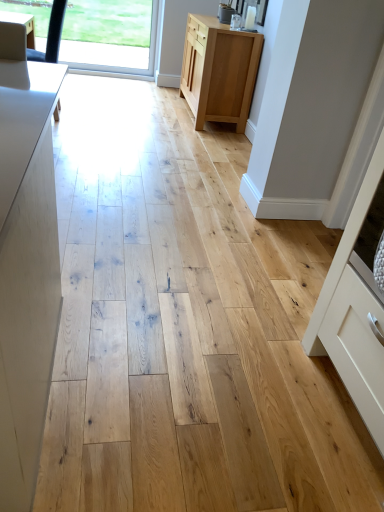
How much space does natural wood cabinet at center, which is the first cabinetry from top to bottom, occupy horizontally?

It is 49.96 centimeters.

This screenshot has width=384, height=512. What do you see at coordinates (114, 54) in the screenshot?
I see `transparent glass window at upper left` at bounding box center [114, 54].

You are a GUI agent. You are given a task and a screenshot of the screen. Output one action in this format:
    pyautogui.click(x=<x>, y=<y>)
    Task: Click on the transparent glass window at upper left
    
    Given the screenshot: What is the action you would take?
    pyautogui.click(x=114, y=54)

Identify the location of white matte cabinet at right, the 1th cabinetry positioned from the right. This screenshot has height=512, width=384. (357, 304).

The height and width of the screenshot is (512, 384). What are the coordinates of `natural wood cabinet at center, which is counted as the second cabinetry, starting from the front` in the screenshot? It's located at (219, 71).

From a real-world perspective, between white matte cabinet at right, the 1th cabinetry positioned from the right, and transparent glass window at upper left, who is vertically higher?

white matte cabinet at right, the 1th cabinetry positioned from the right, from a real-world perspective.

Between point (358, 287) and point (157, 13), which one is positioned behind?

Positioned behind is point (157, 13).

Considering the relative sizes of white matte cabinet at right, arranged as the second cabinetry when viewed from the left, and transparent glass window at upper left in the image provided, is white matte cabinet at right, arranged as the second cabinetry when viewed from the left, wider than transparent glass window at upper left?

Correct, the width of white matte cabinet at right, arranged as the second cabinetry when viewed from the left, exceeds that of transparent glass window at upper left.

Which object is further away from the camera taking this photo, white matte cabinet at right, the 2th cabinetry in the back-to-front sequence, or transparent glass window at upper left?

transparent glass window at upper left.

How different are the orientations of transparent glass window at upper left and white matte cabinet at right, the 2th cabinetry when ordered from top to bottom, in degrees?

89.5 degrees separate the facing orientations of transparent glass window at upper left and white matte cabinet at right, the 2th cabinetry when ordered from top to bottom.

Does transparent glass window at upper left come behind white matte cabinet at right, the first cabinetry positioned from the front?

Yes, the depth of transparent glass window at upper left is greater than that of white matte cabinet at right, the first cabinetry positioned from the front.

Where is `window screen below the white matte cabinet at right, the 2th cabinetry when ordered from top to bottom (from a real-world perspective)`? window screen below the white matte cabinet at right, the 2th cabinetry when ordered from top to bottom (from a real-world perspective) is located at coordinates (114, 54).

Can white matte cabinet at right, the 2th cabinetry in the back-to-front sequence, be found inside transparent glass window at upper left?

No, white matte cabinet at right, the 2th cabinetry in the back-to-front sequence, is not surrounded by transparent glass window at upper left.

The width and height of the screenshot is (384, 512). Identify the location of cabinetry on the right of natural wood cabinet at center, which appears as the second cabinetry when ordered from the bottom. (357, 304).

Which object is further away from the camera, natural wood cabinet at center, which is counted as the second cabinetry, starting from the front, or white matte cabinet at right, arranged as the second cabinetry when viewed from the left?

natural wood cabinet at center, which is counted as the second cabinetry, starting from the front.

Can you see natural wood cabinet at center, which is the first cabinetry from top to bottom, touching white matte cabinet at right, arranged as the second cabinetry when viewed from the left?

No, natural wood cabinet at center, which is the first cabinetry from top to bottom, is not in contact with white matte cabinet at right, arranged as the second cabinetry when viewed from the left.

Is white matte cabinet at right, arranged as the second cabinetry when viewed from the left, completely or partially outside of natural wood cabinet at center, positioned as the first cabinetry in left-to-right order?

Yes, white matte cabinet at right, arranged as the second cabinetry when viewed from the left, is located beyond the bounds of natural wood cabinet at center, positioned as the first cabinetry in left-to-right order.

Find the location of a particular element. The height and width of the screenshot is (512, 384). cabinetry to the left of white matte cabinet at right, the first cabinetry positioned from the front is located at coordinates (219, 71).

Considering the relative positions of white matte cabinet at right, the 2th cabinetry in the back-to-front sequence, and natural wood cabinet at center, positioned as the first cabinetry in left-to-right order, in the image provided, is white matte cabinet at right, the 2th cabinetry in the back-to-front sequence, to the left of natural wood cabinet at center, positioned as the first cabinetry in left-to-right order, from the viewer's perspective?

No.

Which is behind, transparent glass window at upper left or natural wood cabinet at center, which appears as the second cabinetry when ordered from the bottom?

transparent glass window at upper left is more distant.

Is transparent glass window at upper left positioned with its back to natural wood cabinet at center, which is the first cabinetry from top to bottom?

No, natural wood cabinet at center, which is the first cabinetry from top to bottom, is not at the back of transparent glass window at upper left.

Does transparent glass window at upper left have a lesser width compared to natural wood cabinet at center, positioned as the first cabinetry in left-to-right order?

Yes.

Measure the distance from transparent glass window at upper left to natural wood cabinet at center, which is counted as the second cabinetry, starting from the front.

A distance of 1.13 meters exists between transparent glass window at upper left and natural wood cabinet at center, which is counted as the second cabinetry, starting from the front.

Which object is more forward, natural wood cabinet at center, positioned as the first cabinetry in left-to-right order, or transparent glass window at upper left?

natural wood cabinet at center, positioned as the first cabinetry in left-to-right order.

Which is less distant, (219, 75) or (75, 52)?

Point (219, 75) is closer to the camera than point (75, 52).

Consider the image. Choose the correct answer: Is natural wood cabinet at center, which appears as the second cabinetry when ordered from the bottom, inside transparent glass window at upper left or outside it?

natural wood cabinet at center, which appears as the second cabinetry when ordered from the bottom, is located beyond the bounds of transparent glass window at upper left.

From the image's perspective, between natural wood cabinet at center, which appears as the second cabinetry when ordered from the bottom, and transparent glass window at upper left, who is located below?

natural wood cabinet at center, which appears as the second cabinetry when ordered from the bottom, is shown below in the image.

You are a GUI agent. You are given a task and a screenshot of the screen. Output one action in this format:
    pyautogui.click(x=<x>, y=<y>)
    Task: Click on the window screen that appears below the white matte cabinet at right, the 2th cabinetry when ordered from top to bottom (from a real-world perspective)
    This screenshot has width=384, height=512.
    Given the screenshot: What is the action you would take?
    pyautogui.click(x=114, y=54)

Locate an element on the screen. The width and height of the screenshot is (384, 512). cabinetry above the transparent glass window at upper left (from a real-world perspective) is located at coordinates (357, 304).

Estimate the real-world distances between objects in this image. Which object is closer to natural wood cabinet at center, which is the first cabinetry from top to bottom, transparent glass window at upper left or white matte cabinet at right, the 2th cabinetry in the back-to-front sequence?

The object closer to natural wood cabinet at center, which is the first cabinetry from top to bottom, is transparent glass window at upper left.

Which object lies nearer to the anchor point white matte cabinet at right, arranged as the second cabinetry when viewed from the left, natural wood cabinet at center, arranged as the 2th cabinetry when viewed from the right, or transparent glass window at upper left?

natural wood cabinet at center, arranged as the 2th cabinetry when viewed from the right, lies closer to white matte cabinet at right, arranged as the second cabinetry when viewed from the left, than the other object.

From the image, which object appears to be farther from natural wood cabinet at center, which is counted as the second cabinetry, starting from the front, white matte cabinet at right, which ranks as the first cabinetry in bottom-to-top order, or transparent glass window at upper left?

white matte cabinet at right, which ranks as the first cabinetry in bottom-to-top order, is further to natural wood cabinet at center, which is counted as the second cabinetry, starting from the front.

Based on their spatial positions, is transparent glass window at upper left or natural wood cabinet at center, marked as the first cabinetry in a back-to-front arrangement, further from white matte cabinet at right, the 1th cabinetry positioned from the right?

The object further to white matte cabinet at right, the 1th cabinetry positioned from the right, is transparent glass window at upper left.

From the image, which object appears to be farther from transparent glass window at upper left, white matte cabinet at right, the 2th cabinetry when ordered from top to bottom, or natural wood cabinet at center, positioned as the first cabinetry in left-to-right order?

The object further to transparent glass window at upper left is white matte cabinet at right, the 2th cabinetry when ordered from top to bottom.

From the image, which object appears to be nearer to transparent glass window at upper left, natural wood cabinet at center, which appears as the second cabinetry when ordered from the bottom, or white matte cabinet at right, arranged as the second cabinetry when viewed from the left?

Among the two, natural wood cabinet at center, which appears as the second cabinetry when ordered from the bottom, is located nearer to transparent glass window at upper left.

The image size is (384, 512). Find the location of `cabinetry positioned between white matte cabinet at right, arranged as the second cabinetry when viewed from the left, and transparent glass window at upper left from near to far`. cabinetry positioned between white matte cabinet at right, arranged as the second cabinetry when viewed from the left, and transparent glass window at upper left from near to far is located at coordinates (219, 71).